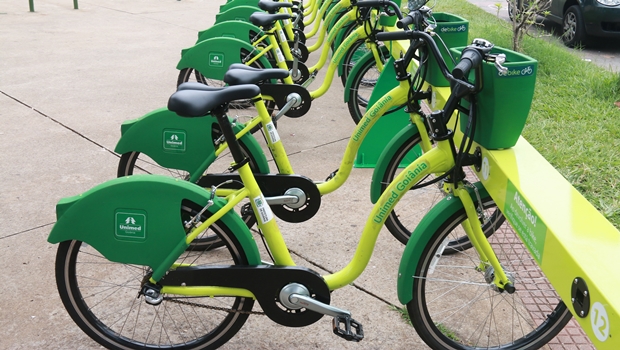
Identify the location of seat. (195, 99), (197, 87), (250, 75), (231, 66), (255, 24), (275, 2).